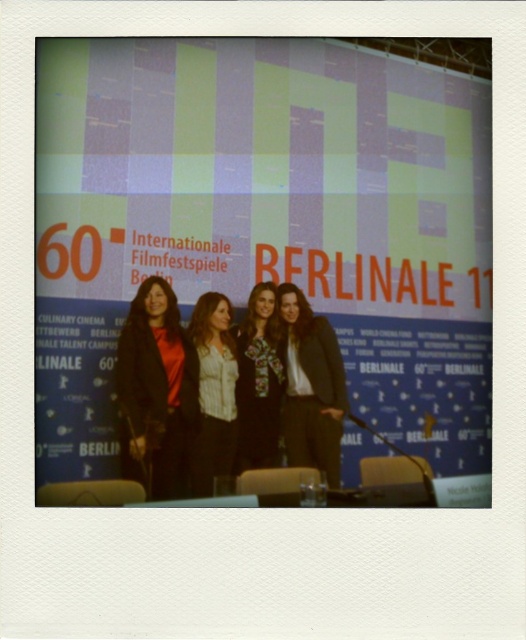
Question: Which point is farther from the camera taking this photo?

Choices:
 (A) (206, 131)
 (B) (304, 452)
 (C) (227, 424)
 (D) (148, 298)

Answer: (A)

Question: Is matte black coat at left further to camera compared to floral-patterned dress at center?

Choices:
 (A) yes
 (B) no

Answer: (B)

Question: Does black leather jacket at center have a lesser width compared to floral-patterned dress at center?

Choices:
 (A) no
 (B) yes

Answer: (A)

Question: Is matte blue backdrop at center further to the viewer compared to floral-patterned dress at center?

Choices:
 (A) no
 (B) yes

Answer: (A)

Question: Among these points, which one is nearest to the camera?

Choices:
 (A) (123, 184)
 (B) (323, 317)
 (C) (148, 422)

Answer: (C)

Question: Considering the real-world distances, which object is closest to the white textured blouse at center?

Choices:
 (A) matte black coat at left
 (B) floral-patterned dress at center
 (C) matte blue backdrop at center

Answer: (B)